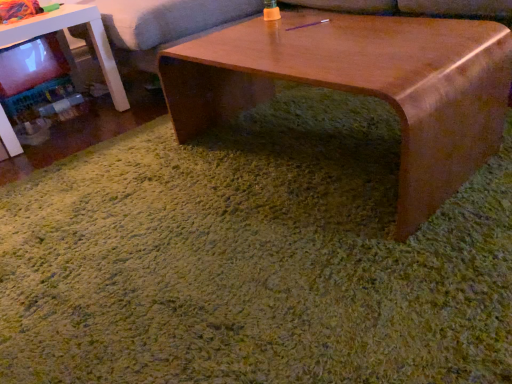
This screenshot has height=384, width=512. Identify the location of free space in front of wooden coffee table at center. (316, 271).